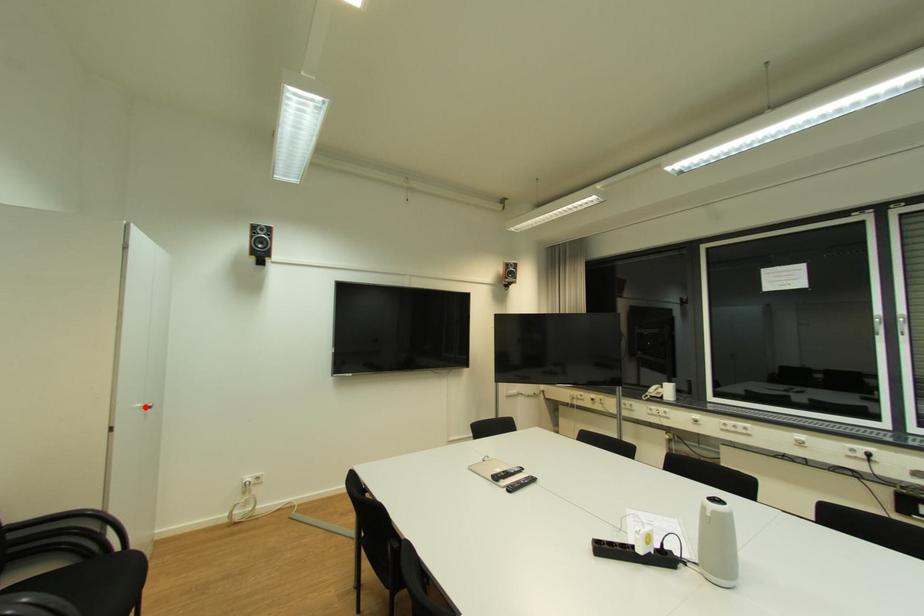
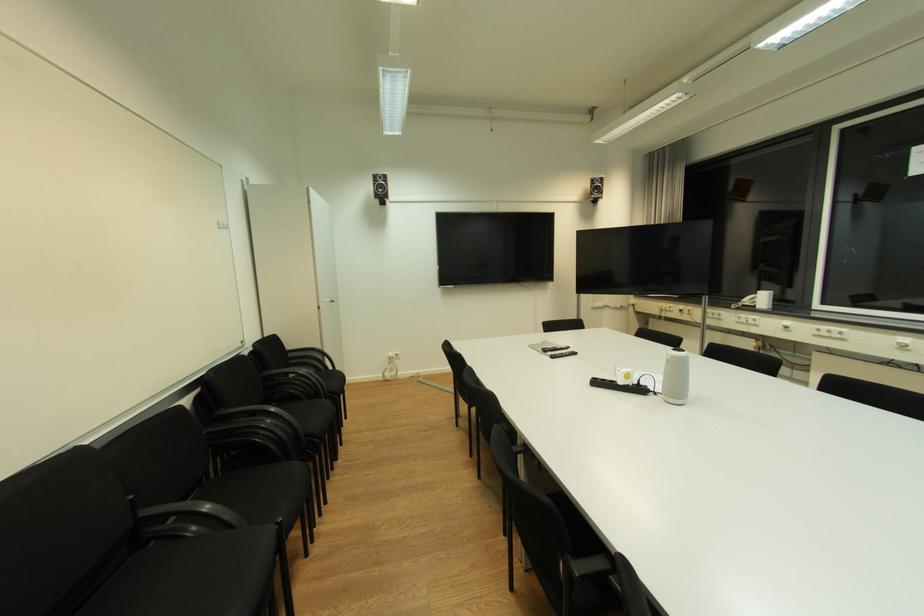
The point at the highlighted location is marked in the first image. Where is the corresponding point in the second image?

(334, 301)